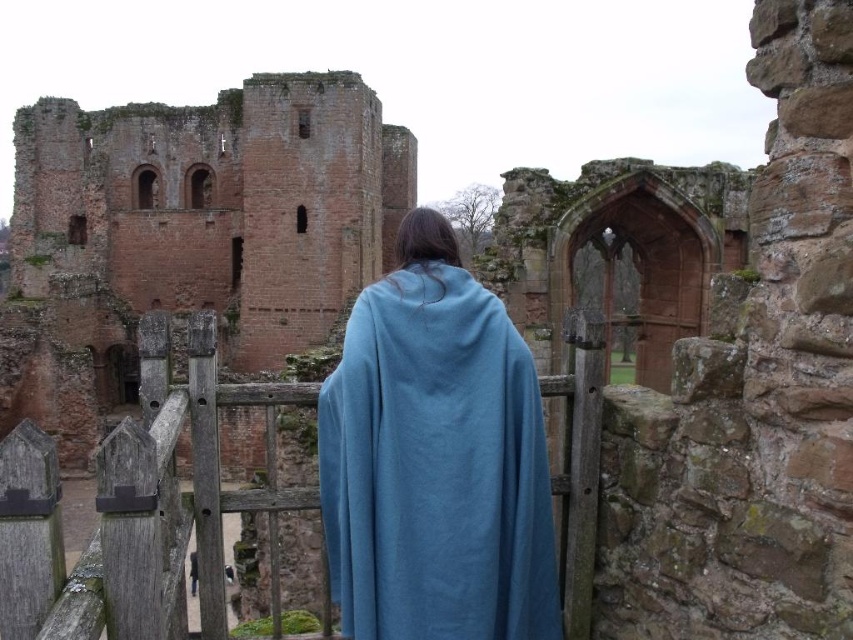
Question: Which point is farther from the camera taking this photo?

Choices:
 (A) (490, 508)
 (B) (91, 227)
 (C) (107, 476)

Answer: (B)

Question: Among these objects, which one is farthest from the camera?

Choices:
 (A) red brick wall at left
 (B) blue woolen cloak at center
 (C) wooden at center

Answer: (A)

Question: Which object is positioned farthest from the wooden at center?

Choices:
 (A) red brick wall at left
 (B) blue woolen cloak at center

Answer: (A)

Question: Does blue woolen cloak at center appear under wooden at center?

Choices:
 (A) yes
 (B) no

Answer: (B)

Question: Is red brick wall at left below wooden at center?

Choices:
 (A) no
 (B) yes

Answer: (A)

Question: In this image, where is blue woolen cloak at center located relative to wooden at center?

Choices:
 (A) right
 (B) left

Answer: (A)